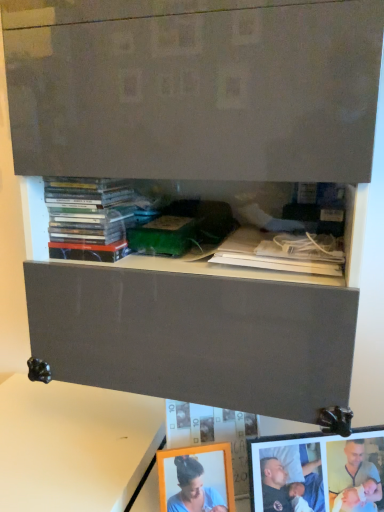
You are a GUI agent. You are given a task and a screenshot of the screen. Output one action in this format:
    pyautogui.click(x=<x>, y=<y>)
    Task: Click on the free area below matte plastic books at upper left, which is the second book in right-to-left order (from a real-world perspective)
    
    Given the screenshot: What is the action you would take?
    pyautogui.click(x=114, y=435)